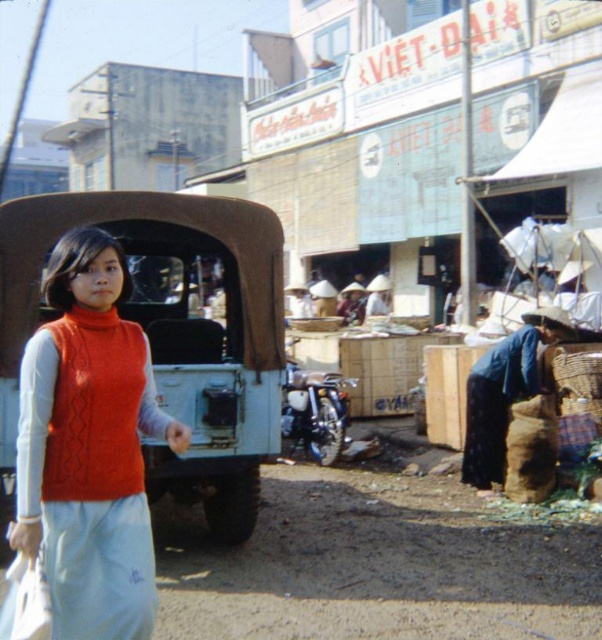
Between cable-knit sweater at center and blue fabric bag at lower right, which one is positioned lower?

Positioned lower is blue fabric bag at lower right.

Which is more to the right, cable-knit sweater at center or blue fabric bag at lower right?

blue fabric bag at lower right is more to the right.

Where is `cable-knit sweater at center`? This screenshot has height=640, width=602. cable-knit sweater at center is located at coordinates [x=90, y=445].